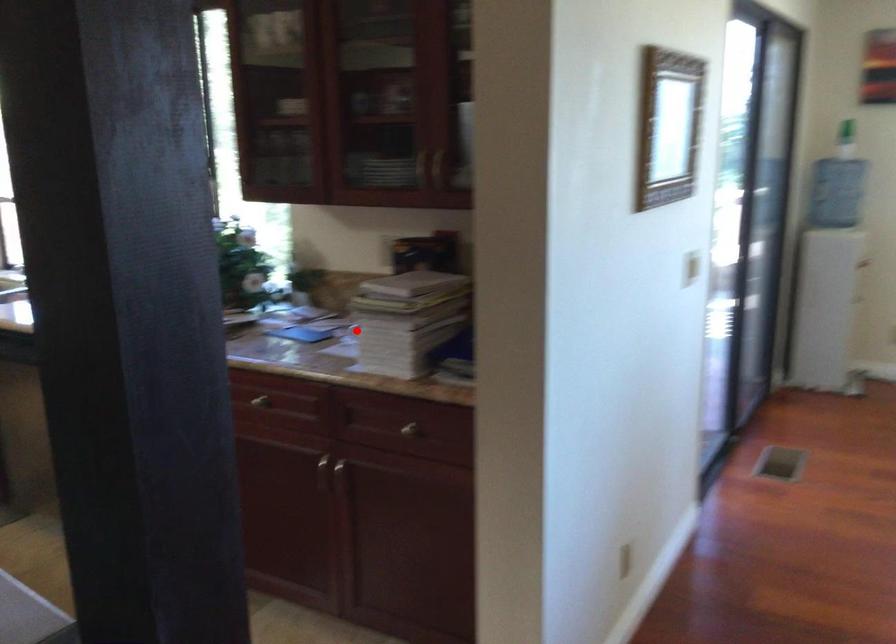
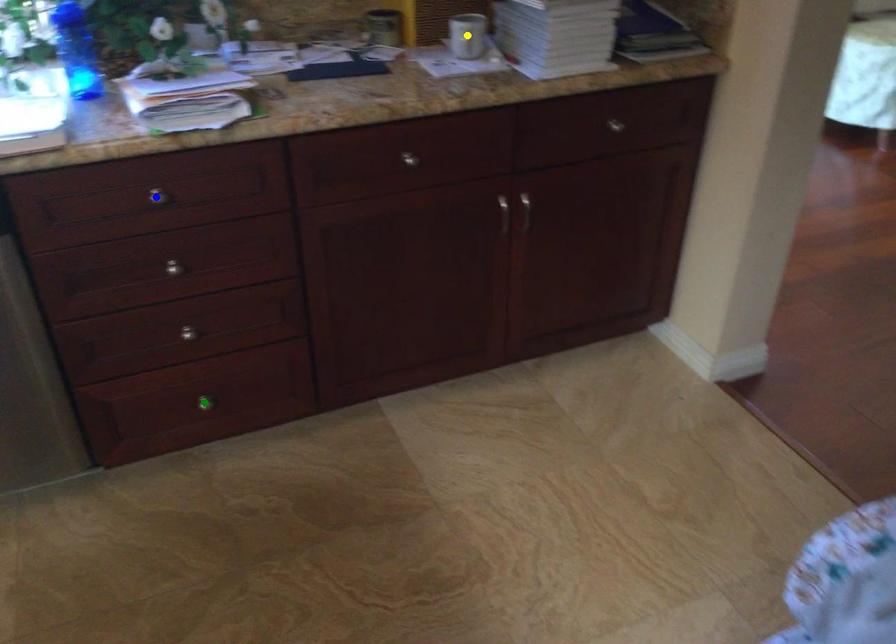
Question: I am providing you with two images of the same scene from different viewpoints. A red point is marked on the first image. You are given multiple points on the second image. Can you choose the point in image 2 that corresponds to the point in image 1?

Choices:
 (A) yellow point
 (B) blue point
 (C) green point

Answer: (A)